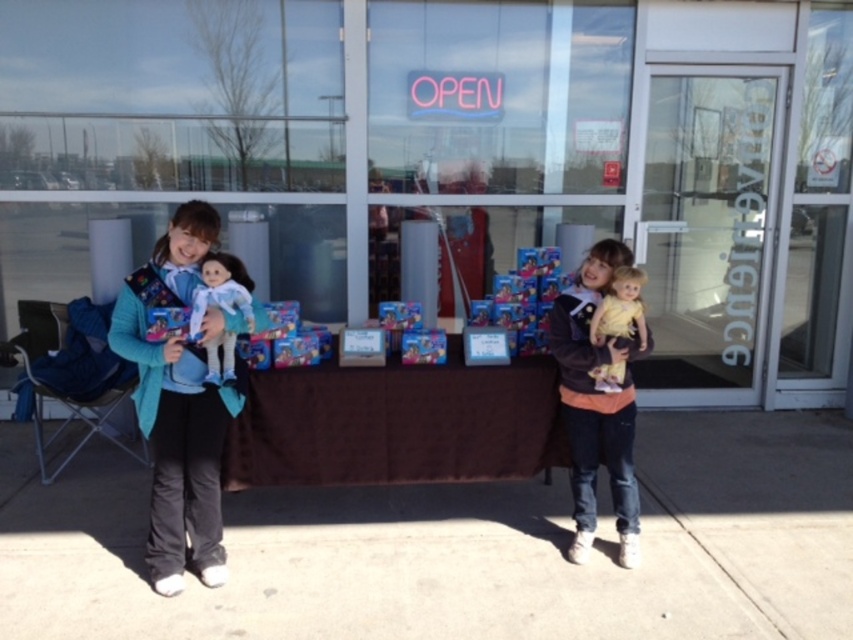
Which is below, teal fabric carrier at left or velvet brown jacket at center?

Positioned lower is velvet brown jacket at center.

Between teal fabric carrier at left and velvet brown jacket at center, which one has more height?

Standing taller between the two is teal fabric carrier at left.

Identify the location of teal fabric carrier at left. Image resolution: width=853 pixels, height=640 pixels. (177, 404).

Does brown fabric table at center appear under velvet brown jacket at center?

Correct, brown fabric table at center is located below velvet brown jacket at center.

Can you confirm if brown fabric table at center is positioned to the right of velvet brown jacket at center?

In fact, brown fabric table at center is to the left of velvet brown jacket at center.

Image resolution: width=853 pixels, height=640 pixels. Describe the element at coordinates (396, 422) in the screenshot. I see `brown fabric table at center` at that location.

Identify the location of brown fabric table at center. The width and height of the screenshot is (853, 640). (396, 422).

Does point (625, 502) come closer to viewer compared to point (225, 358)?

That is False.

Is point (578, 324) more distant than point (225, 256)?

Yes, it is behind point (225, 256).

Between point (563, 323) and point (230, 296), which one is positioned in front?

Point (230, 296)

Locate an element on the screen. velvet brown jacket at center is located at coordinates (596, 404).